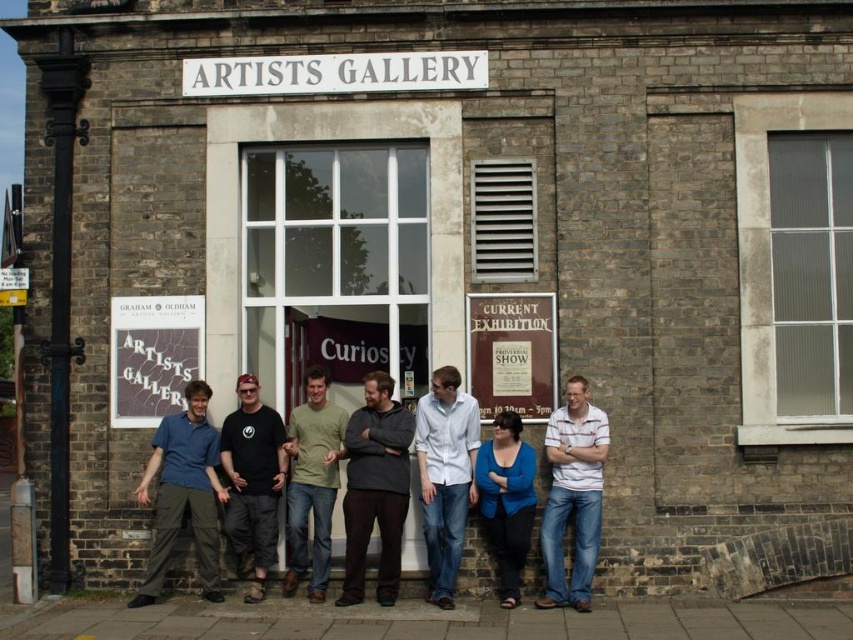
Is point (456, 518) closer to viewer compared to point (306, 433)?

Yes, point (456, 518) is closer to viewer.

Is point (451, 512) more distant than point (309, 452)?

No.

Locate an element on the screen. The height and width of the screenshot is (640, 853). white cotton shirt at center is located at coordinates (445, 476).

Is dark gray sweater at center wider than white cotton shirt at center?

Indeed, dark gray sweater at center has a greater width compared to white cotton shirt at center.

Is point (380, 445) positioned behind point (471, 452)?

No, (380, 445) is in front of (471, 452).

Where is `dark gray sweater at center`? dark gray sweater at center is located at coordinates (375, 486).

Consider the image. Who is shorter, matte blue shirt at center or white striped shirt at right?

white striped shirt at right is shorter.

Image resolution: width=853 pixels, height=640 pixels. What are the coordinates of `matte blue shirt at center` in the screenshot? It's located at (183, 493).